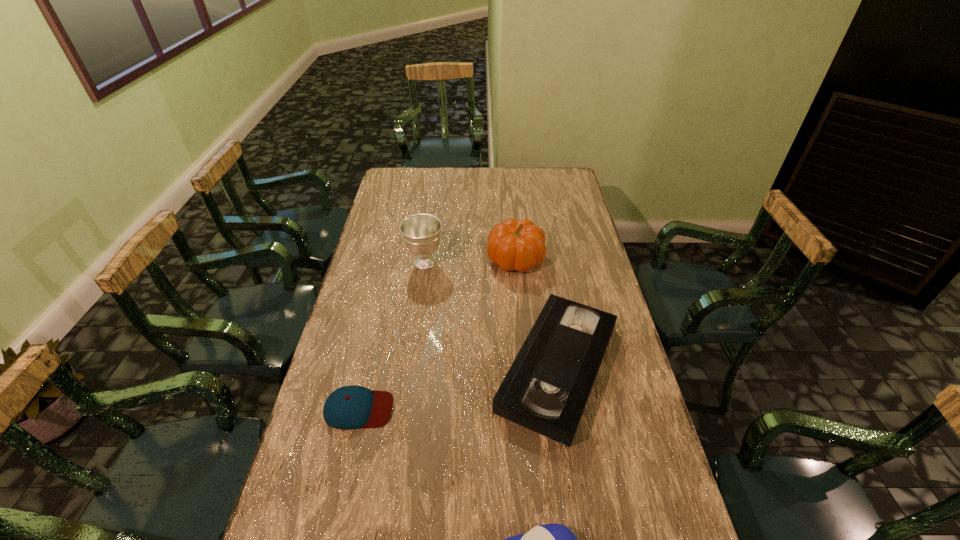
This screenshot has width=960, height=540. In order to click on blank region between the videotape and the pumpkin in this screenshot , I will do `click(537, 313)`.

The height and width of the screenshot is (540, 960). I want to click on the third closest object to the right baseball cap, so click(x=519, y=245).

Identify which object is the fourth nearest to the pumpkin. Please provide its 2D coordinates. Your answer should be formatted as a tuple, i.e. [(x, y)], where the tuple contains the x and y coordinates of a point satisfying the conditions above.

[(550, 539)]

Where is `free spot that satisfies the following two spatial constraints: 1. on the front side of the videotape; 2. on the left side of the pumpkin`? Image resolution: width=960 pixels, height=540 pixels. free spot that satisfies the following two spatial constraints: 1. on the front side of the videotape; 2. on the left side of the pumpkin is located at coordinates (525, 368).

Locate an element on the screen. This screenshot has width=960, height=540. vacant point that satisfies the following two spatial constraints: 1. on the front side of the pumpkin; 2. with the bill of the farther baseball cap facing forward is located at coordinates (529, 409).

Identify the location of vacant space that satisfies the following two spatial constraints: 1. on the back side of the chalice; 2. on the right side of the pumpkin. The width and height of the screenshot is (960, 540). (425, 259).

Find the location of a particular element. vacant space that satisfies the following two spatial constraints: 1. on the front side of the pumpkin; 2. on the right side of the videotape is located at coordinates (525, 368).